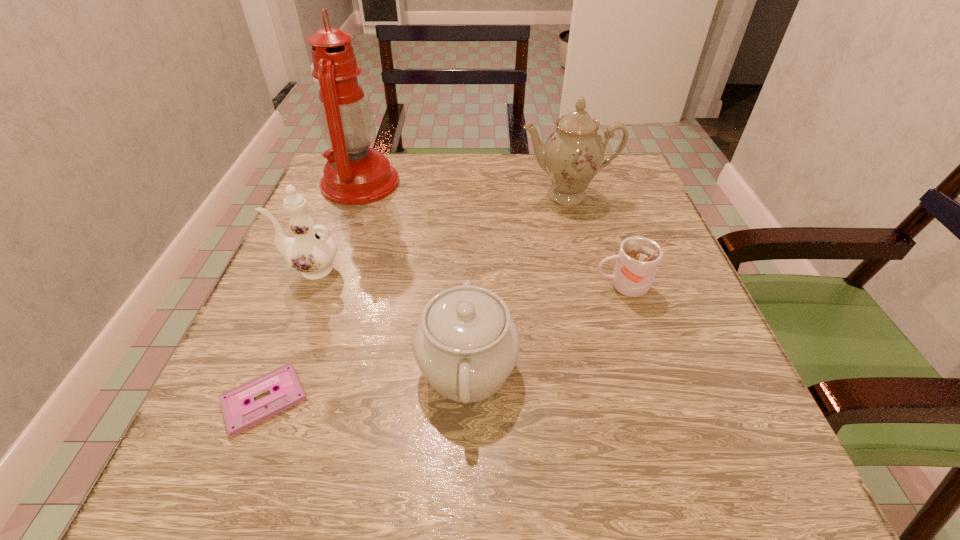
This screenshot has width=960, height=540. Identify the location of vacant space located on the spout of the farthest chinaware. (601, 335).

I want to click on vacant space located on the back of the second chinaware from right to left, so click(469, 286).

Identify the location of free space located 0.100m on the side with the handle of the fifth tallest object. The height and width of the screenshot is (540, 960). (540, 287).

This screenshot has height=540, width=960. Find the location of `free location located 0.160m on the side with the handle of the fifth tallest object`. free location located 0.160m on the side with the handle of the fifth tallest object is located at coordinates (507, 287).

This screenshot has height=540, width=960. Find the location of `free space located on the side with the handle of the fifth tallest object`. free space located on the side with the handle of the fifth tallest object is located at coordinates (544, 287).

This screenshot has width=960, height=540. In order to click on vacant space located on the right of the videotape in this screenshot , I will do `click(382, 400)`.

Image resolution: width=960 pixels, height=540 pixels. Find the location of `oil lamp located at the far edge`. oil lamp located at the far edge is located at coordinates (354, 174).

The image size is (960, 540). What are the coordinates of `chinaware that is positioned at the far edge` in the screenshot? It's located at (573, 154).

This screenshot has width=960, height=540. Identify the location of object present at the near edge. (239, 415).

Identify the location of oil lamp that is positioned at the left edge. Image resolution: width=960 pixels, height=540 pixels. (354, 174).